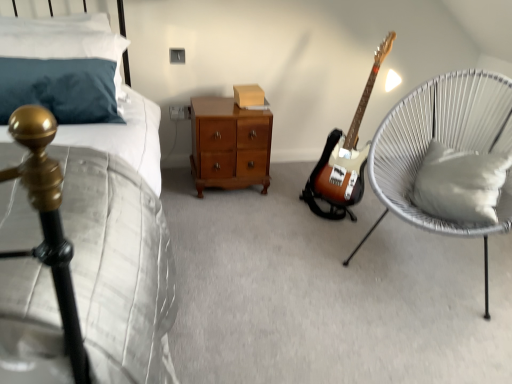
The height and width of the screenshot is (384, 512). Find the location of `free point to the left of white woven chair at right`. free point to the left of white woven chair at right is located at coordinates (290, 278).